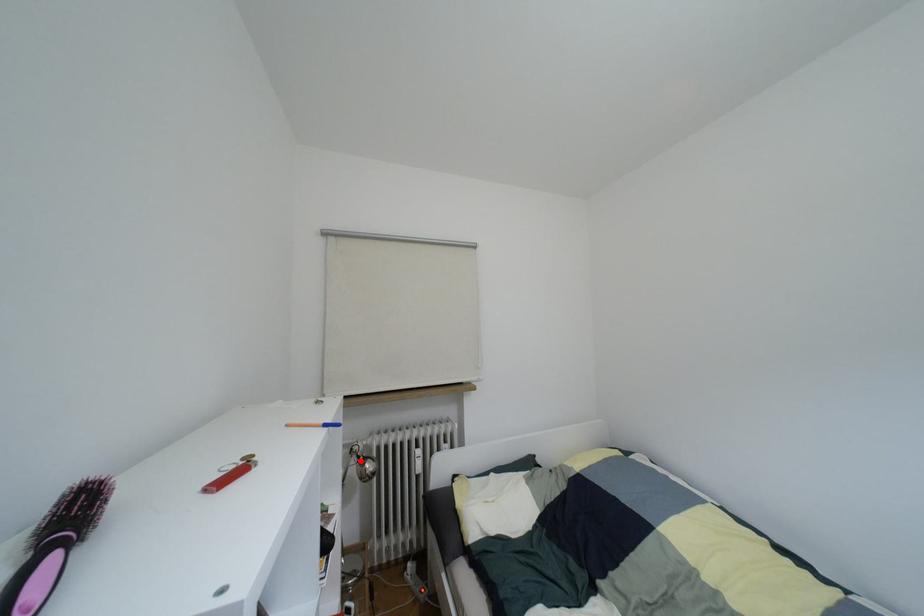
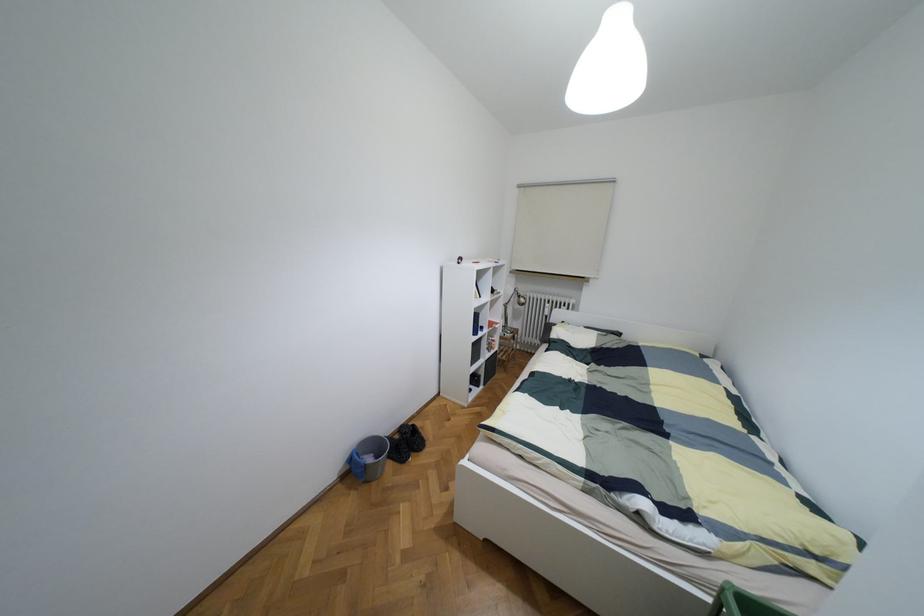
Question: I am providing you with two images of the same scene from different viewpoints. Image1 has a red point marked. In image2, the corresponding 3D location appears at what relative position? Reply with the corresponding letter.

Choices:
 (A) Closer
 (B) Farther

Answer: (A)